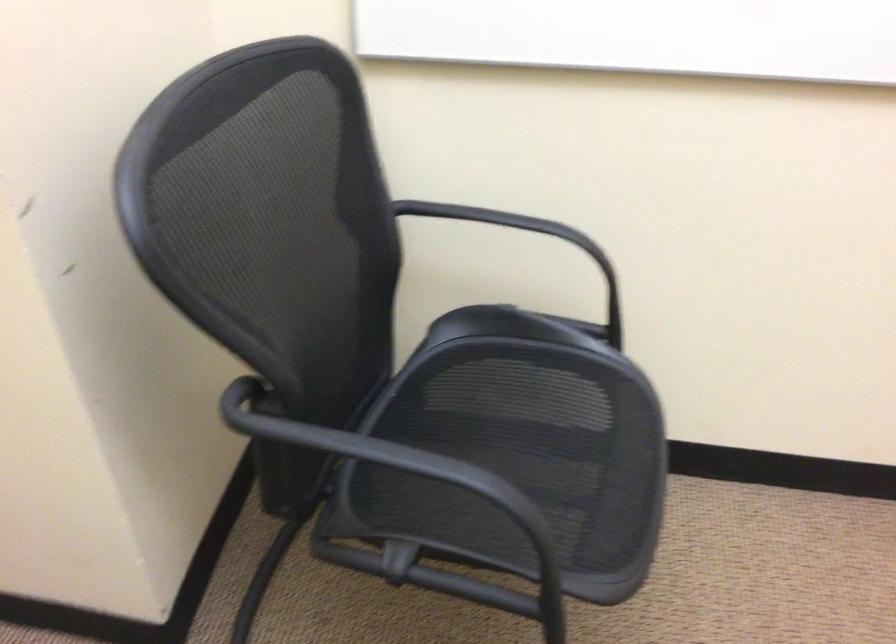
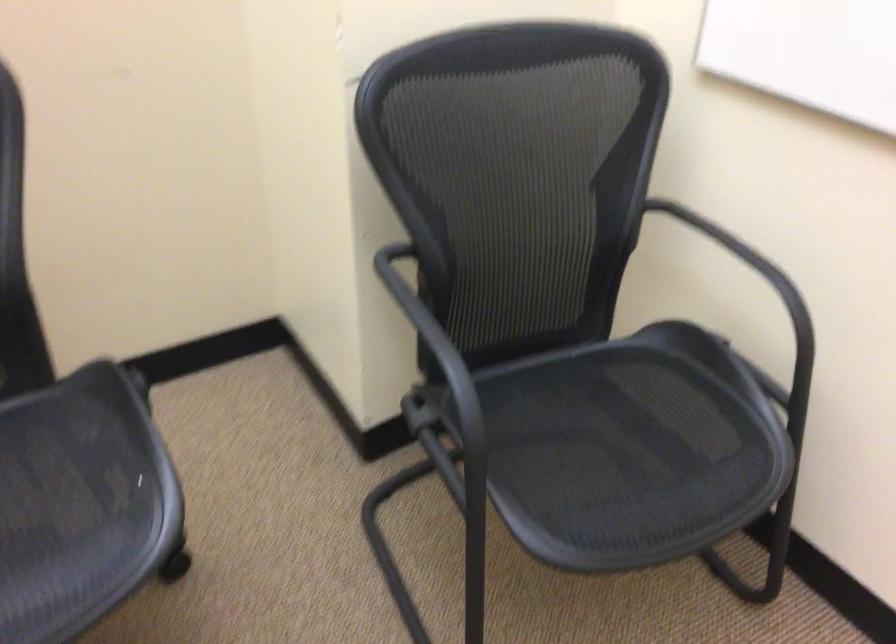
Where in the second image is the point corresponding to (554,462) from the first image?

(626, 453)